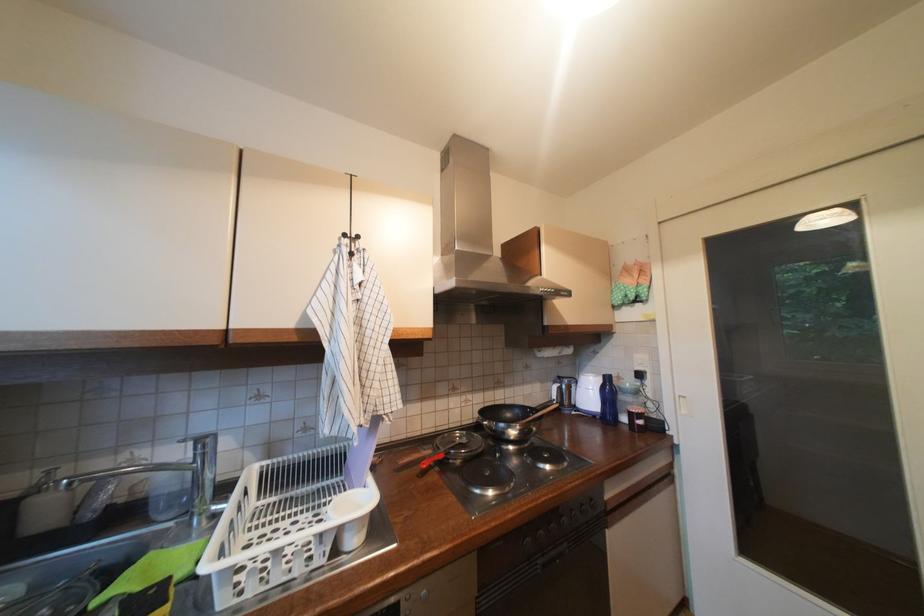
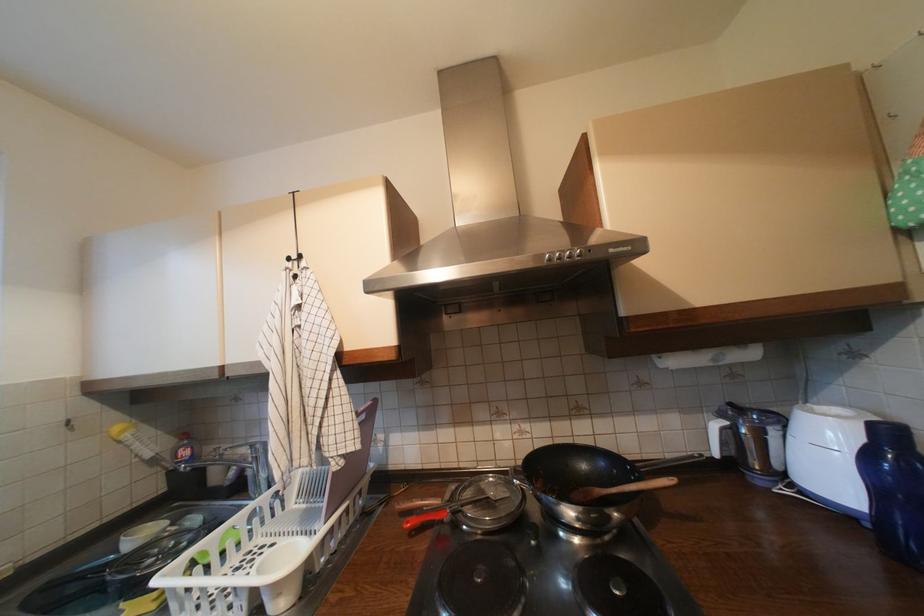
Find the pixel in the second image that matches (x=548, y=353) in the first image.

(669, 359)